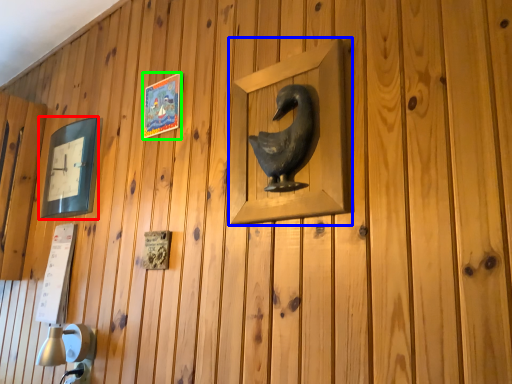
Question: Which object is the farthest from picture frame (highlighted by a red box)? Choose among these: picture frame (highlighted by a blue box) or picture frame (highlighted by a green box).

Choices:
 (A) picture frame
 (B) picture frame

Answer: (A)